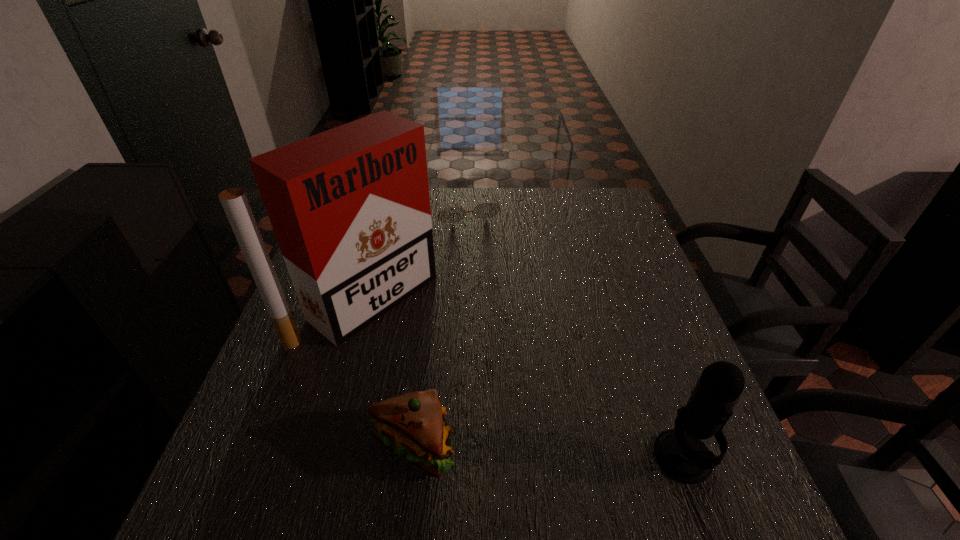
The width and height of the screenshot is (960, 540). Identify the location of vacant area between the third tallest object and the sunglasses. (439, 327).

The height and width of the screenshot is (540, 960). I want to click on free area in between the second tallest object and the tallest object, so click(525, 378).

Identify the location of the closest object to the farthest object. (350, 208).

Select which object appears as the third closest to the second tallest object. Please provide its 2D coordinates. Your answer should be formatted as a tuple, i.e. [(x, y)], where the tuple contains the x and y coordinates of a point satisfying the conditions above.

[(485, 210)]

Find the location of a particular element. Image resolution: width=960 pixels, height=540 pixels. vacant area that satisfies the following two spatial constraints: 1. on the front side of the farthest object; 2. on the left side of the microphone is located at coordinates (453, 457).